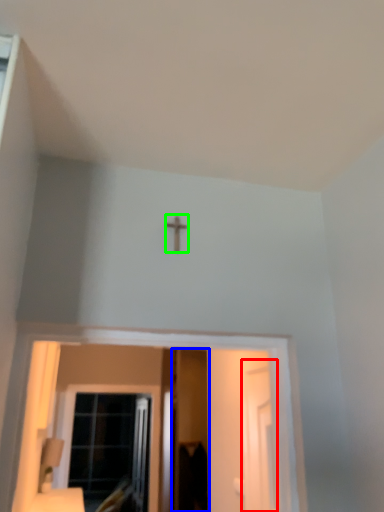
Question: Considering the real-world distances, which object is closest to screen door (highlighted by a red box)? screen door (highlighted by a blue box) or crucifix (highlighted by a green box).

Choices:
 (A) screen door
 (B) crucifix

Answer: (B)